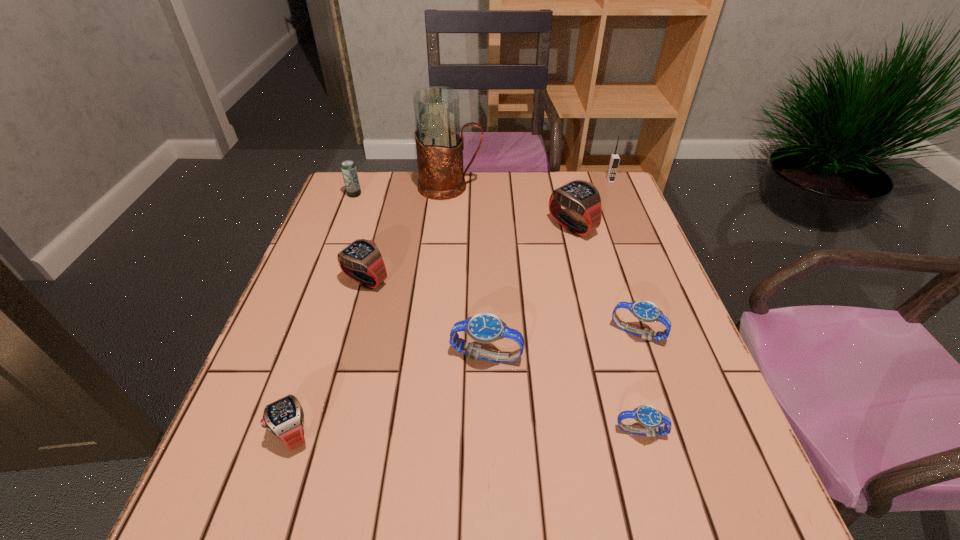
The height and width of the screenshot is (540, 960). In order to click on the second biggest blue watch in this screenshot , I will do `click(645, 311)`.

You are a GUI agent. You are given a task and a screenshot of the screen. Output one action in this format:
    pyautogui.click(x=<x>, y=<y>)
    Task: Click on the smallest red watch
    Image resolution: width=960 pixels, height=540 pixels.
    Given the screenshot: What is the action you would take?
    pyautogui.click(x=284, y=418)

You are a GUI agent. You are given a task and a screenshot of the screen. Output one action in this format:
    pyautogui.click(x=<x>, y=<y>)
    Task: Click on the shortest watch
    
    Given the screenshot: What is the action you would take?
    pyautogui.click(x=651, y=418)

Where is `the smallest blue watch`? The height and width of the screenshot is (540, 960). the smallest blue watch is located at coordinates (651, 418).

The image size is (960, 540). I want to click on vacant space located with the handle on the side of the pitcher, so click(x=550, y=187).

Identify the location of free location located 0.390m on the front-facing side of the cellular telephone. This screenshot has height=540, width=960. (645, 265).

Where is `free region located 0.130m on the left of the farthest red watch`? Image resolution: width=960 pixels, height=540 pixels. free region located 0.130m on the left of the farthest red watch is located at coordinates (502, 227).

I want to click on free location located 0.140m on the front of the beer can, so click(x=343, y=226).

Locate an element on the screen. This screenshot has height=540, width=960. free space located on the front of the fifth farthest object is located at coordinates (349, 340).

The height and width of the screenshot is (540, 960). Find the location of `free region located on the back of the third watch from left to right`. free region located on the back of the third watch from left to right is located at coordinates (485, 232).